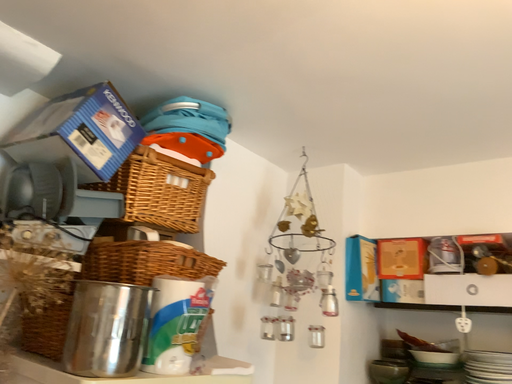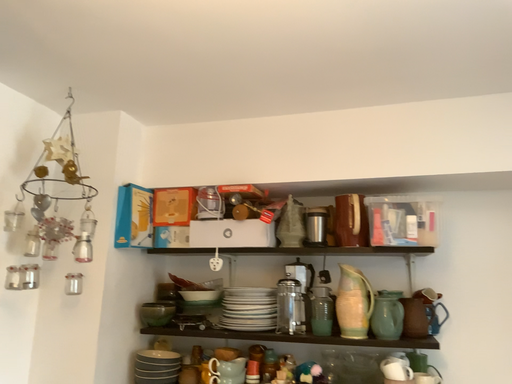
Question: How did the camera likely rotate when shooting the video?

Choices:
 (A) rotated upward
 (B) rotated downward

Answer: (B)